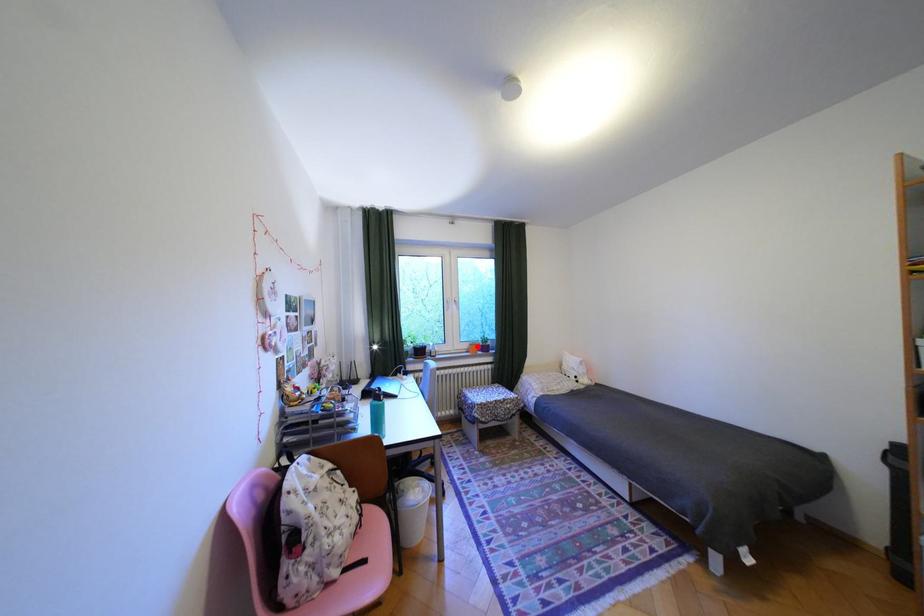
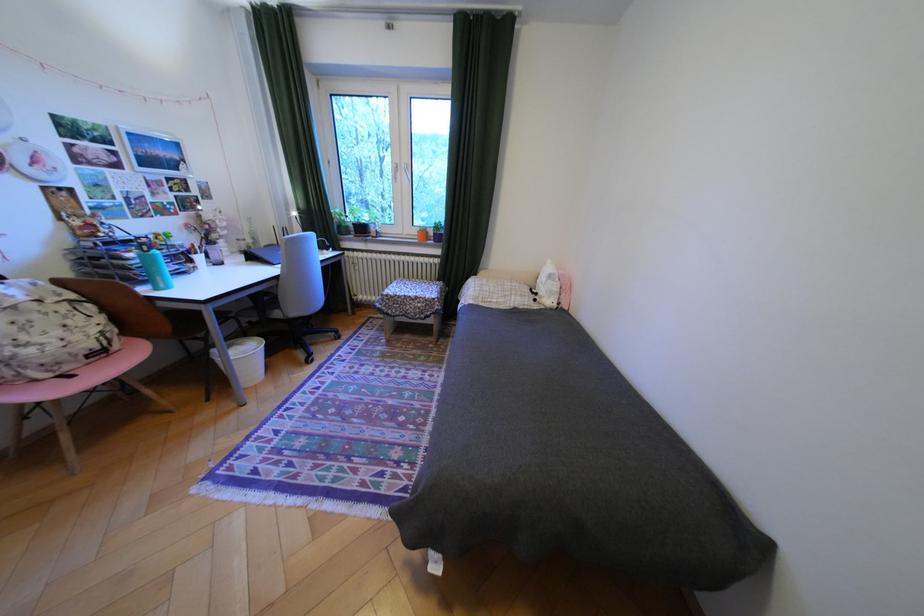
The point at the highlighted location is marked in the first image. Where is the corresponding point in the second image?

(427, 232)